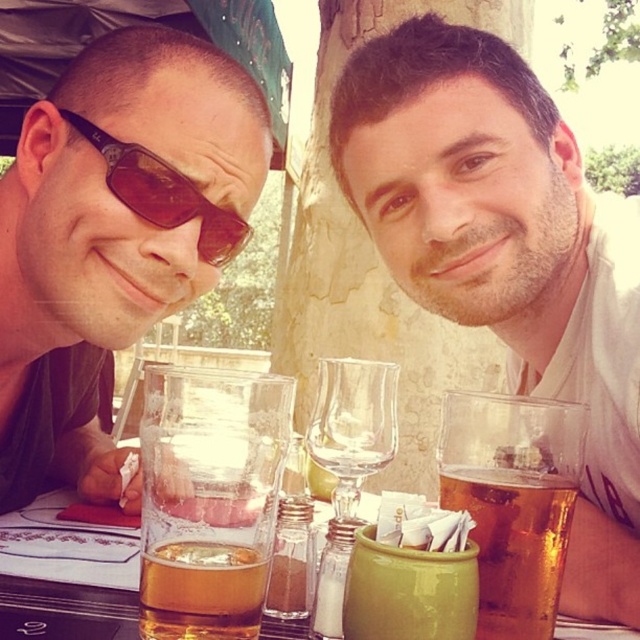
Consider the image. Does translucent glass mug at center have a smaller size compared to transparent glass wine glass at center?

Indeed, translucent glass mug at center has a smaller size compared to transparent glass wine glass at center.

Between translucent glass mug at center and transparent glass wine glass at center, which one is positioned lower?

translucent glass mug at center is lower down.

The image size is (640, 640). In order to click on translucent glass mug at center in this screenshot , I will do `click(515, 545)`.

Who is higher up, matte black sunglasses at left or transparent glass wine glass at center?

matte black sunglasses at left

In the scene shown: Does matte black sunglasses at left appear over transparent glass wine glass at center?

Indeed, matte black sunglasses at left is positioned over transparent glass wine glass at center.

Is point (106, 42) positioned in front of point (387, 396)?

No, it is not.

You are a GUI agent. You are given a task and a screenshot of the screen. Output one action in this format:
    pyautogui.click(x=<x>, y=<y>)
    Task: Click on the matte black sunglasses at left
    The height and width of the screenshot is (640, 640).
    Given the screenshot: What is the action you would take?
    pyautogui.click(x=113, y=237)

Based on the photo, is amber glass at center shorter than brown reflective sunglasses at left?

Correct, amber glass at center is not as tall as brown reflective sunglasses at left.

Which of these two, amber glass at center or brown reflective sunglasses at left, stands taller?

Standing taller between the two is brown reflective sunglasses at left.

Which is in front, point (168, 605) or point (228, 221)?

Positioned in front is point (168, 605).

Where is `amber glass at center`? amber glass at center is located at coordinates (202, 592).